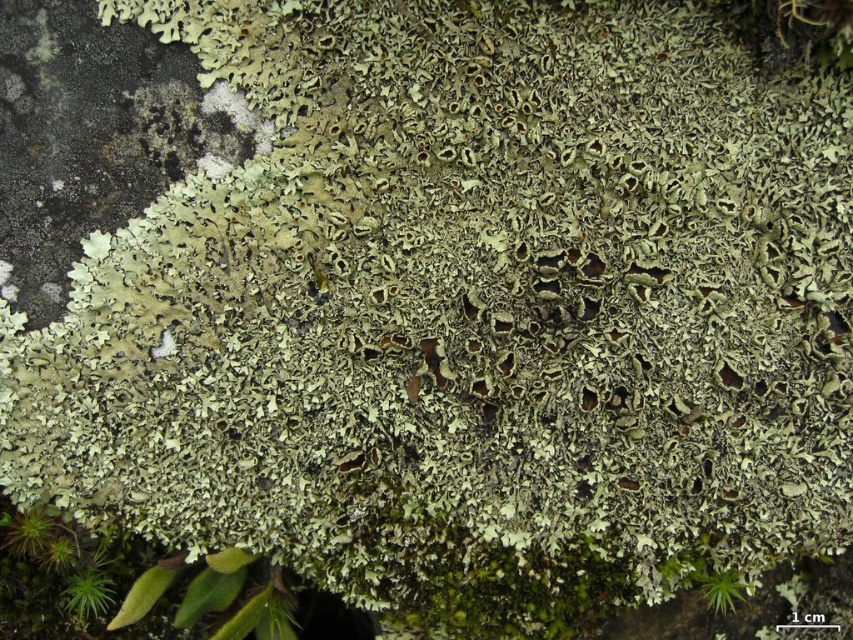
You are a botanist examining the lichen covered surface. You notice a point at coordinate (86, 593). What is located at this point?

At point (86, 593) lies green fuzzy moss at lower left.

You are observing the lichen covered surface and notice two green fuzzy moss patches. From your viewpoint, which one is closer to you, the green fuzzy moss at lower left or the green fuzzy moss at lower right?

The green fuzzy moss at lower left is closer to you because the green fuzzy moss at lower right is behind it.